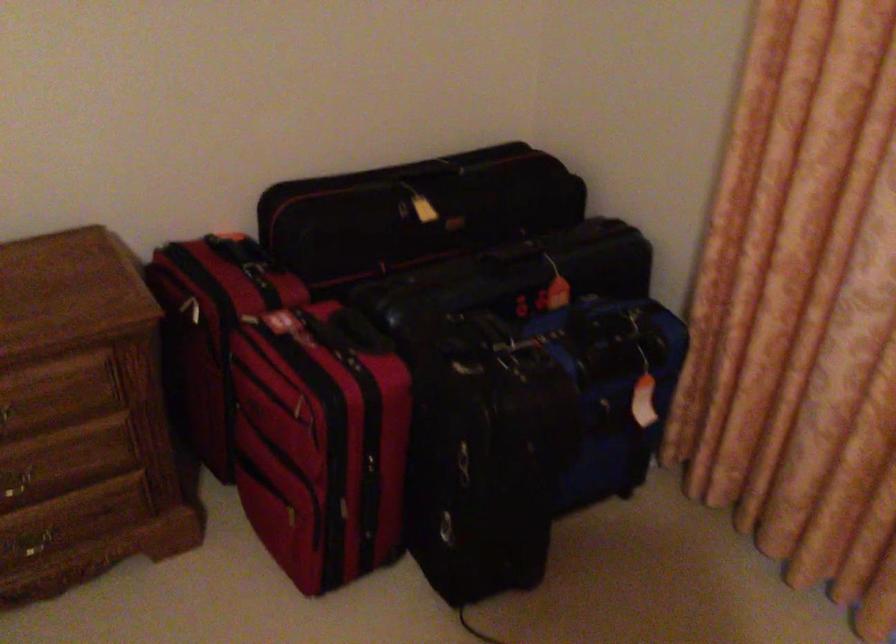
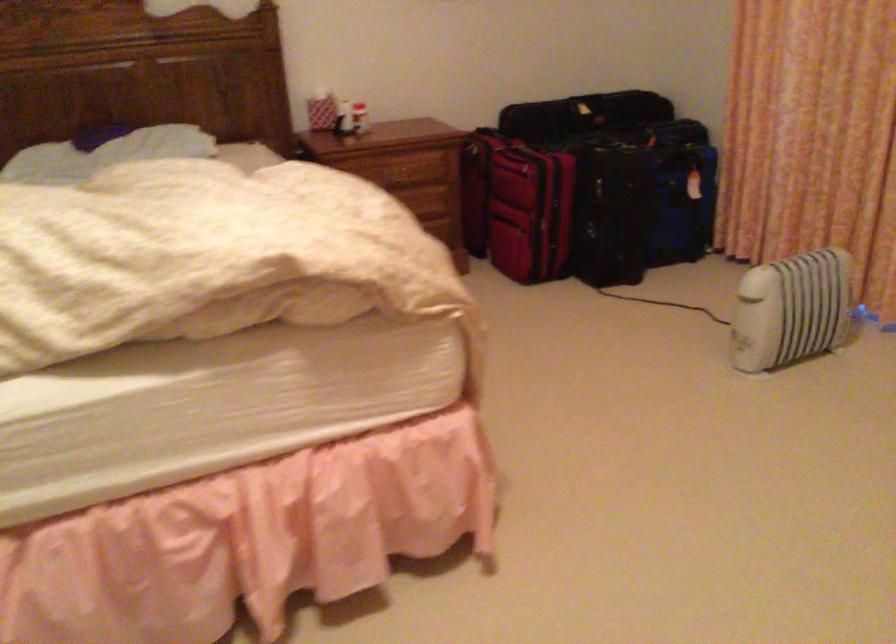
Question: The images are taken continuously from a first-person perspective. In which direction are you moving?

Choices:
 (A) Left
 (B) Right
 (C) Forward
 (D) Backward

Answer: (D)